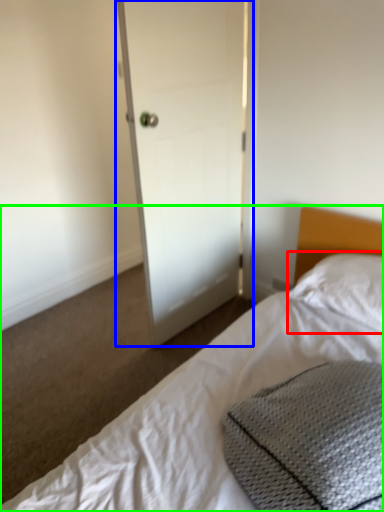
Question: Which object is the closest to the pillow (highlighted by a red box)? Choose among these: door (highlighted by a blue box) or bed (highlighted by a green box).

Choices:
 (A) door
 (B) bed

Answer: (B)